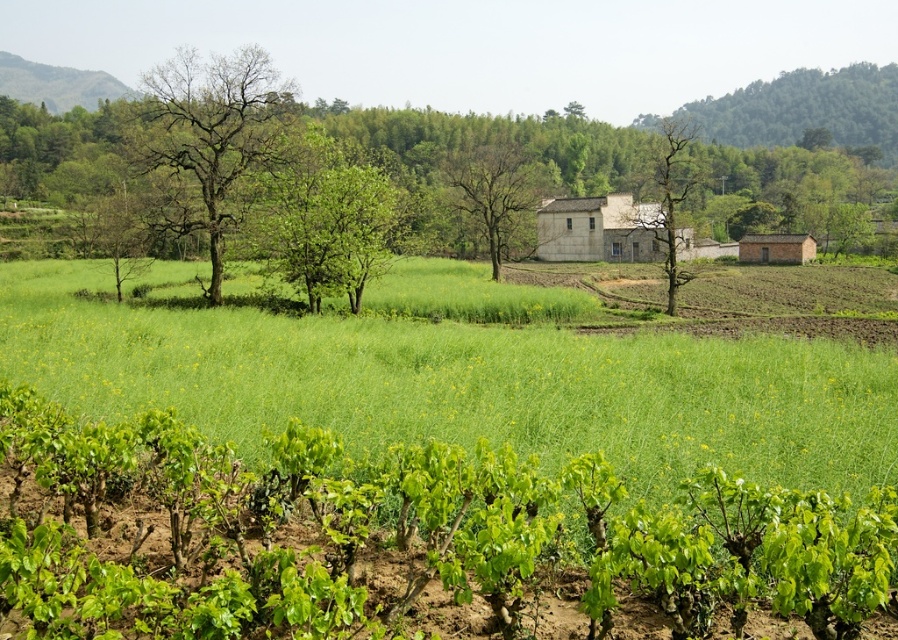
You are a farmer checking the growth of your crops. You notice the green grass at center and the bare branches at left in your field. Which one is shorter in height?

The green grass at center is shorter than the bare branches at left.

Looking at this image, you are standing in the middle of the vineyard and looking towards the fields. Which tree do you see higher up in the sky between the bare branches at left and the green leafy tree at center?

The bare branches at left is higher up in the sky than the green leafy tree at center.